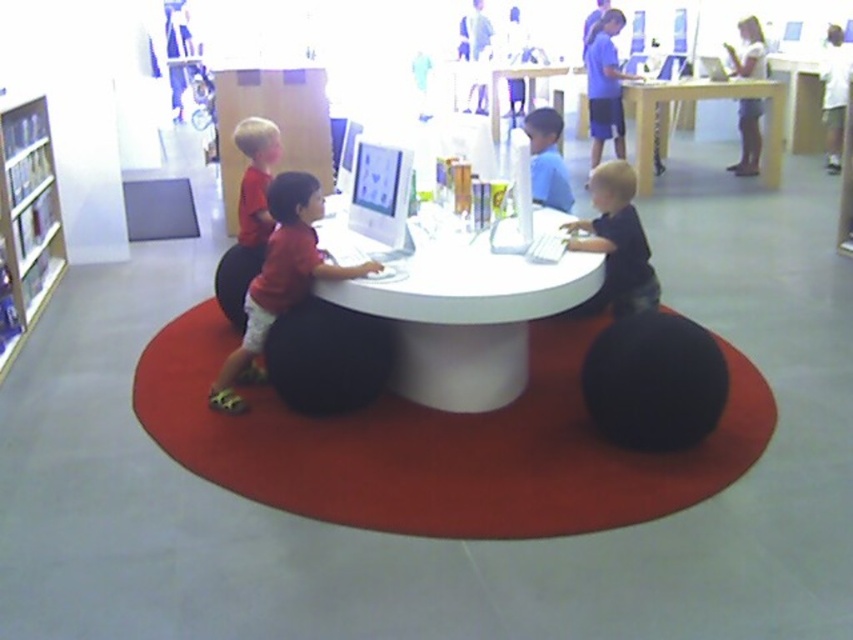
Is white glossy round table at center to the left of wooden bookshelf at left from the viewer's perspective?

In fact, white glossy round table at center is to the right of wooden bookshelf at left.

Describe the element at coordinates (465, 316) in the screenshot. I see `white glossy round table at center` at that location.

This screenshot has height=640, width=853. What do you see at coordinates (465, 316) in the screenshot?
I see `white glossy round table at center` at bounding box center [465, 316].

Find the location of a particular element. The height and width of the screenshot is (640, 853). white glossy round table at center is located at coordinates (465, 316).

Can you confirm if matte white monitor at center is bigger than blue matte shirt at upper right?

No.

Who is more distant from viewer, (x=361, y=161) or (x=610, y=10)?

Positioned behind is point (x=610, y=10).

At what (x,y) coordinates should I click in order to perform the action: click on matte white monitor at center. Please return your answer as a coordinate pair (x, y). Looking at the image, I should click on (380, 193).

Describe the element at coordinates (465, 316) in the screenshot. I see `white glossy round table at center` at that location.

Between point (471, 266) and point (590, 173), which one is positioned behind?

The point (590, 173) is behind.

The height and width of the screenshot is (640, 853). What are the coordinates of `white glossy round table at center` in the screenshot? It's located at (465, 316).